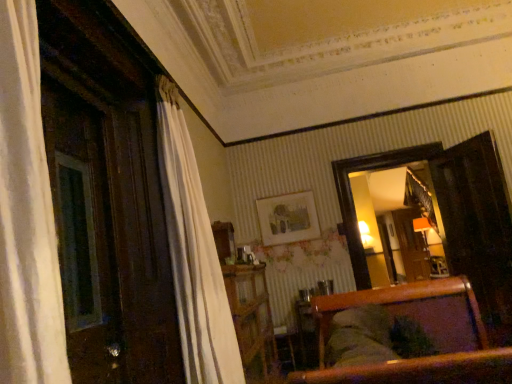
Measure the distance between wooden armchair at center and camera.

wooden armchair at center is 4.95 feet away from camera.

In order to face wooden armchair at center, should I rotate leftwards or rightwards?

Turn right by 23.629 degrees to look at wooden armchair at center.

Locate an element on the screen. This screenshot has height=384, width=512. wooden dresser at center is located at coordinates (251, 316).

At what (x,y) coordinates should I click in order to perform the action: click on wooden armchair at center. Please return your answer as a coordinate pair (x, y). The width and height of the screenshot is (512, 384). Looking at the image, I should click on (426, 332).

Relative to matte wooden picture frame at center, is wooden armchair at center in front or behind?

In the image, wooden armchair at center appears in front of matte wooden picture frame at center.

Is wooden armchair at center facing towards matte wooden picture frame at center?

No, wooden armchair at center does not turn towards matte wooden picture frame at center.

From the picture: Between wooden armchair at center and matte wooden picture frame at center, which one has larger size?

wooden armchair at center.

Considering the sizes of objects wooden armchair at center and wooden dresser at center in the image provided, who is shorter, wooden armchair at center or wooden dresser at center?

With less height is wooden armchair at center.

Considering the sizes of wooden armchair at center and wooden dresser at center in the image, is wooden armchair at center bigger or smaller than wooden dresser at center?

Clearly, wooden armchair at center is larger in size than wooden dresser at center.

How distant is wooden armchair at center from wooden dresser at center?

wooden armchair at center is 4.45 feet away from wooden dresser at center.

This screenshot has width=512, height=384. Identify the location of furniture in front of the wooden dresser at center. pos(426,332).

From a real-world perspective, is matte wooden picture frame at center physically below wooden armchair at center?

No, from a real-world perspective, matte wooden picture frame at center is not below wooden armchair at center.

How many degrees apart are the facing directions of matte wooden picture frame at center and wooden armchair at center?

91 degrees separate the facing orientations of matte wooden picture frame at center and wooden armchair at center.

Is matte wooden picture frame at center taller than wooden armchair at center?

No.

Which is behind, matte wooden picture frame at center or wooden armchair at center?

matte wooden picture frame at center is behind.

What's the angular difference between wooden dresser at center and wooden armchair at center's facing directions?

1.88 degrees separate the facing orientations of wooden dresser at center and wooden armchair at center.

Can you confirm if wooden dresser at center is taller than wooden armchair at center?

Correct, wooden dresser at center is much taller as wooden armchair at center.

From the image's perspective, which is above, wooden dresser at center or wooden armchair at center?

wooden armchair at center.

Is the position of wooden dresser at center more distant than that of wooden armchair at center?

Yes, wooden dresser at center is further from the viewer.

Is matte wooden picture frame at center taller or shorter than wooden dresser at center?

In the image, matte wooden picture frame at center appears to be shorter than wooden dresser at center.

Locate an element on the screen. Image resolution: width=512 pixels, height=384 pixels. picture frame above the wooden dresser at center (from a real-world perspective) is located at coordinates (288, 218).

Which object is further away from the camera taking this photo, matte wooden picture frame at center or wooden dresser at center?

matte wooden picture frame at center is further from the camera.

In the scene shown: Considering the sizes of matte wooden picture frame at center and wooden dresser at center in the image, is matte wooden picture frame at center wider or thinner than wooden dresser at center?

In the image, matte wooden picture frame at center appears to be more narrow than wooden dresser at center.

Based on the photo, is wooden dresser at center in front of or behind matte wooden picture frame at center in the image?

wooden dresser at center is in front of matte wooden picture frame at center.

Are wooden dresser at center and matte wooden picture frame at center located far from each other?

Yes, wooden dresser at center and matte wooden picture frame at center are quite far apart.

From a real-world perspective, is wooden dresser at center physically below matte wooden picture frame at center?

Yes, from a real-world perspective, wooden dresser at center is below matte wooden picture frame at center.

Measure the distance from wooden dresser at center to matte wooden picture frame at center.

1.58 meters.

Find the location of a particular element. The height and width of the screenshot is (384, 512). picture frame above the wooden armchair at center (from a real-world perspective) is located at coordinates (288, 218).

The height and width of the screenshot is (384, 512). Identify the location of furniture that is on the right side of wooden dresser at center. (426, 332).

Looking at the image, which one is located closer to matte wooden picture frame at center, wooden dresser at center or wooden armchair at center?

wooden dresser at center is closer to matte wooden picture frame at center.

Looking at the image, which one is located further to wooden armchair at center, matte wooden picture frame at center or wooden dresser at center?

matte wooden picture frame at center is positioned further to the anchor wooden armchair at center.

From the image, which object appears to be farther from wooden armchair at center, wooden dresser at center or matte wooden picture frame at center?

Based on the image, matte wooden picture frame at center appears to be further to wooden armchair at center.

Based on their spatial positions, is matte wooden picture frame at center or wooden armchair at center further from wooden dresser at center?

The object further to wooden dresser at center is matte wooden picture frame at center.

Based on their spatial positions, is wooden armchair at center or matte wooden picture frame at center further from wooden dresser at center?

Based on the image, matte wooden picture frame at center appears to be further to wooden dresser at center.

Based on their spatial positions, is wooden armchair at center or wooden dresser at center further from matte wooden picture frame at center?

Based on the image, wooden armchair at center appears to be further to matte wooden picture frame at center.

Find the location of a particular element. dresser between wooden armchair at center and matte wooden picture frame at center along the z-axis is located at coordinates (251, 316).